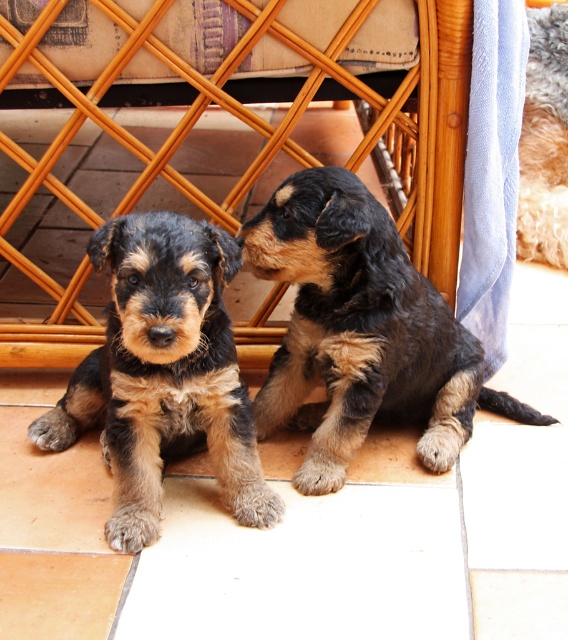
Question: Does brown fur puppy at center have a greater width compared to fuzzy brown fur at center?

Choices:
 (A) yes
 (B) no

Answer: (A)

Question: Is black fur puppy at center positioned behind brown fur puppy at center?

Choices:
 (A) yes
 (B) no

Answer: (A)

Question: Which object is positioned farthest from the black fur puppy at center?

Choices:
 (A) fuzzy brown fur at center
 (B) brown fur puppy at center
 (C) woven wood chair at center

Answer: (A)

Question: Among these points, which one is nearest to the camera?

Choices:
 (A) (176, 240)
 (B) (542, 164)

Answer: (A)

Question: Is black fur puppy at center closer to the viewer compared to brown fur puppy at center?

Choices:
 (A) no
 (B) yes

Answer: (A)

Question: Considering the real-world distances, which object is farthest from the woven wood chair at center?

Choices:
 (A) brown fur puppy at center
 (B) black fur puppy at center

Answer: (A)